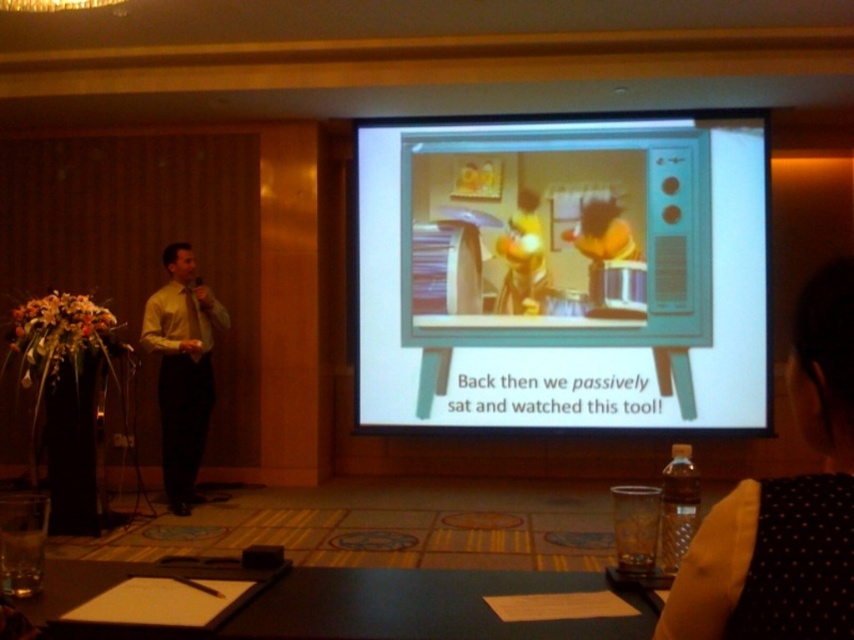
Between black leather table at lower center and yellow shirt at left, which one is positioned higher?

yellow shirt at left is above.

Who is taller, black leather table at lower center or yellow shirt at left?

With more height is yellow shirt at left.

Between point (582, 579) and point (168, 492), which one is positioned in front?

Point (582, 579)

This screenshot has width=854, height=640. Find the location of `black leather table at lower center`. black leather table at lower center is located at coordinates (349, 604).

Between point (453, 332) and point (182, 456), which one is positioned behind?

The point (453, 332) is behind.

Is point (712, 364) closer to camera compared to point (190, 292)?

No, (712, 364) is further to viewer.

You are a GUI agent. You are given a task and a screenshot of the screen. Output one action in this format:
    pyautogui.click(x=<x>, y=<y>)
    Task: Click on the matte plastic television at center
    This screenshot has width=854, height=640.
    Given the screenshot: What is the action you would take?
    pyautogui.click(x=563, y=275)

What do you see at coordinates (563, 275) in the screenshot? The height and width of the screenshot is (640, 854). I see `matte plastic television at center` at bounding box center [563, 275].

Between matte plastic television at center and black leather table at lower center, which one is positioned lower?

black leather table at lower center is below.

Which is in front, point (679, 381) or point (26, 605)?

Point (26, 605) is more forward.

Where is `matte plastic television at center`? The width and height of the screenshot is (854, 640). matte plastic television at center is located at coordinates (563, 275).